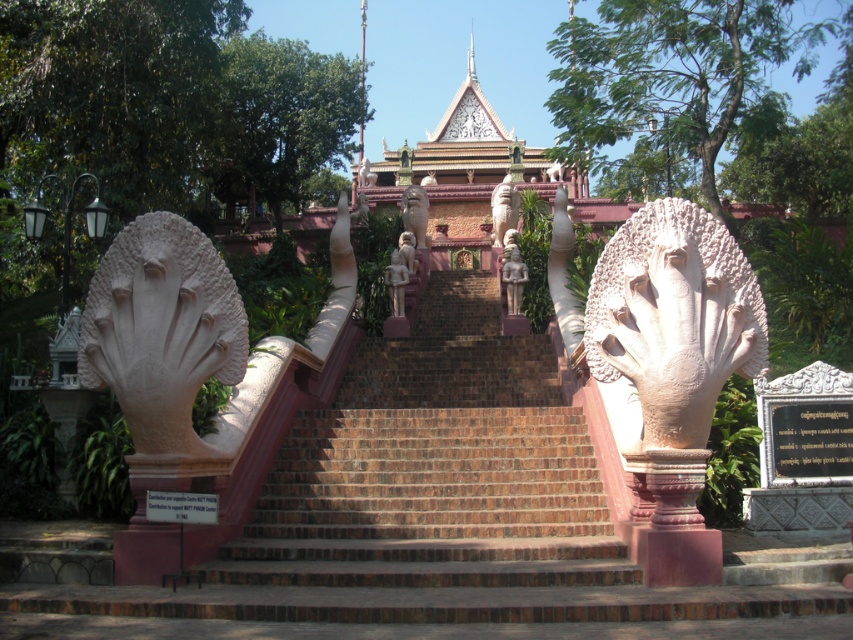
You are standing at the bottom of the grand staircase leading to the temple. You notice a point marked at coordinates (514,280). Which object does this point belong to?

The point at (514,280) is on the stone statue at center.

You are standing at the bottom of the staircase and see both the stone statue at center and the polished bronze statue at center. Which one is positioned to the right when viewed from your perspective?

The stone statue at center is positioned to the right of the polished bronze statue at center when viewed from your perspective.